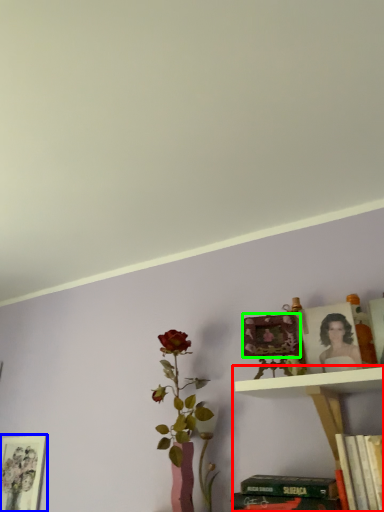
Question: Which object is positioned farthest from shelf (highlighted by a red box)? Select from picture frame (highlighted by a blue box) and picture frame (highlighted by a green box).

Choices:
 (A) picture frame
 (B) picture frame

Answer: (A)